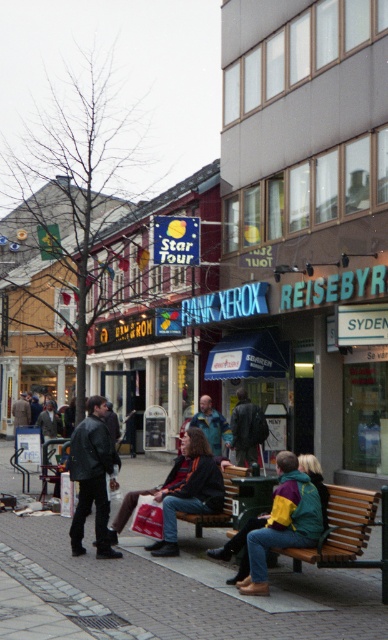
You are standing at the point marked as point (91, 476) in the image. What object is located exactly at that coordinate?

The point (91, 476) corresponds to the dark gray leather jacket at center.

You are a tailor observing two jackets displayed in a shop window. The jackets are the dark gray leather jacket at center and the green fabric jacket at center. Which jacket appears taller when viewed from the street?

The dark gray leather jacket at center appears taller than the green fabric jacket at center.